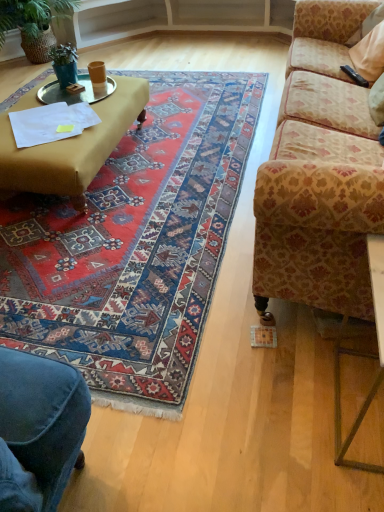
Locate an element on the screen. This screenshot has width=384, height=512. free space between metallic gold table at lower right and patterned fabric couch at right is located at coordinates (297, 387).